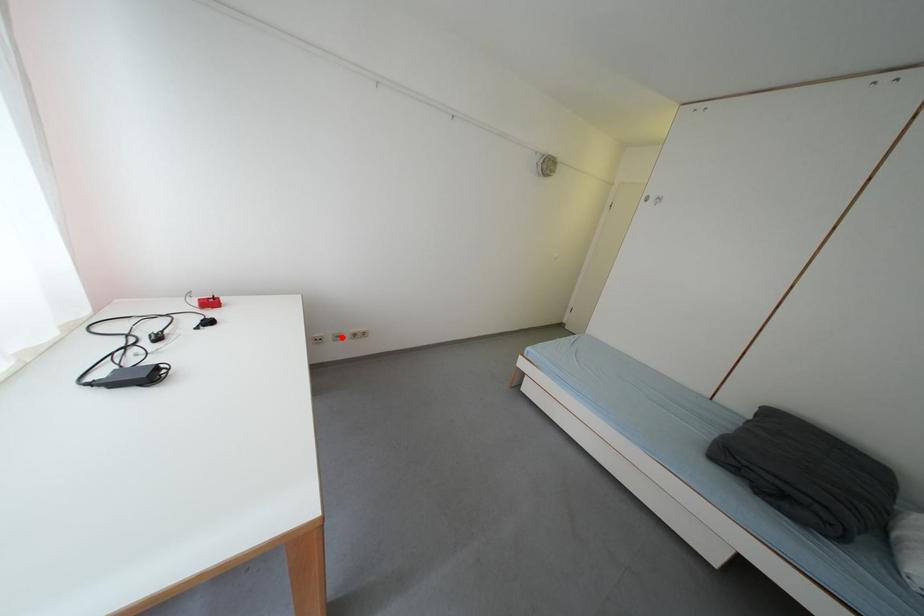
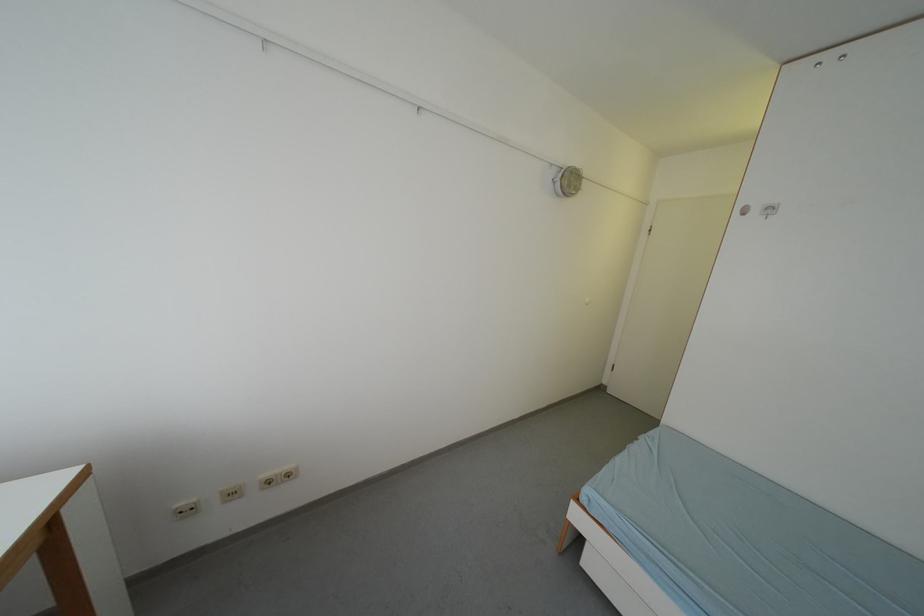
In the second image, find the point that corresponds to the highlighted location in the first image.

(229, 496)